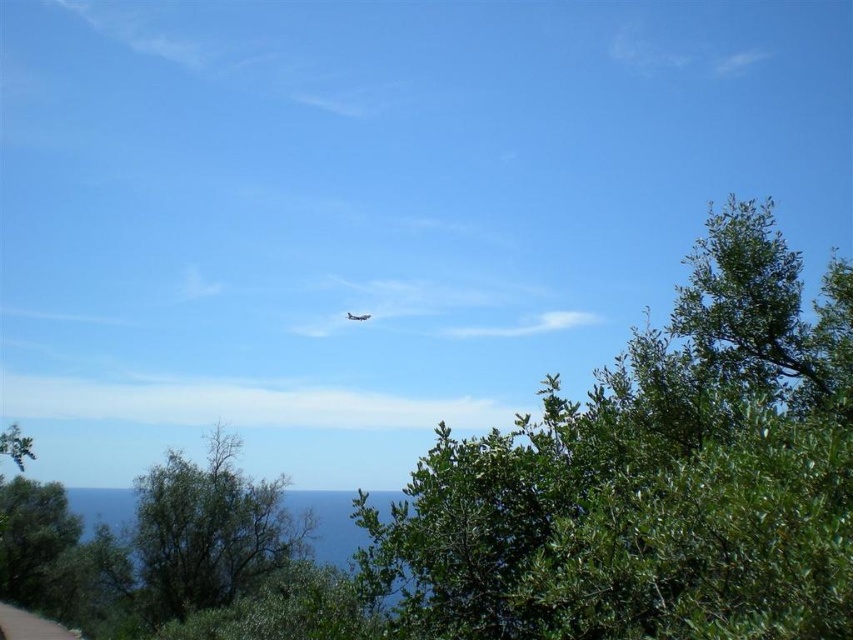
Does green leafy tree at lower left have a lesser height compared to metallic silver airplane at center?

Correct, green leafy tree at lower left is not as tall as metallic silver airplane at center.

Does green leafy tree at lower left appear on the right side of metallic silver airplane at center?

No, green leafy tree at lower left is not to the right of metallic silver airplane at center.

Who is more forward, (151, 531) or (357, 316)?

Point (151, 531)

Locate an element on the screen. The width and height of the screenshot is (853, 640). green leafy tree at lower left is located at coordinates (207, 531).

Who is positioned more to the left, green leafy tree at upper center or green leafy tree at lower left?

Positioned to the left is green leafy tree at lower left.

Is green leafy tree at upper center below green leafy tree at lower left?

No.

At what (x,y) coordinates should I click in order to perform the action: click on green leafy tree at upper center. Please return your answer as a coordinate pair (x, y). Looking at the image, I should click on (653, 477).

Does brown dirt path at lower left have a greater width compared to metallic silver airplane at center?

Indeed, brown dirt path at lower left has a greater width compared to metallic silver airplane at center.

Is the position of brown dirt path at lower left less distant than that of metallic silver airplane at center?

Yes, it is in front of metallic silver airplane at center.

Does point (67, 636) come in front of point (360, 316)?

Yes, point (67, 636) is closer to viewer.

Identify the location of brown dirt path at lower left. Image resolution: width=853 pixels, height=640 pixels. (30, 625).